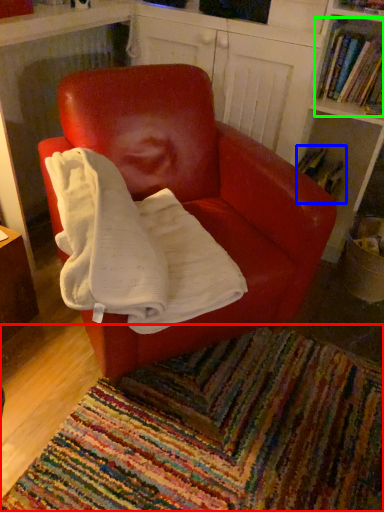
Question: Considering the real-world distances, which object is closest to mat (highlighted by a red box)? book (highlighted by a blue box) or book (highlighted by a green box).

Choices:
 (A) book
 (B) book

Answer: (A)